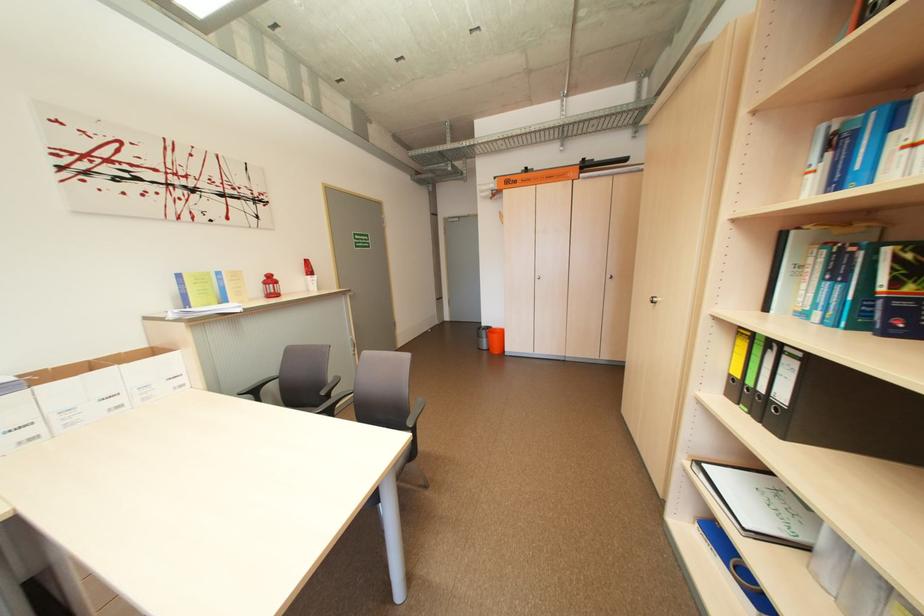
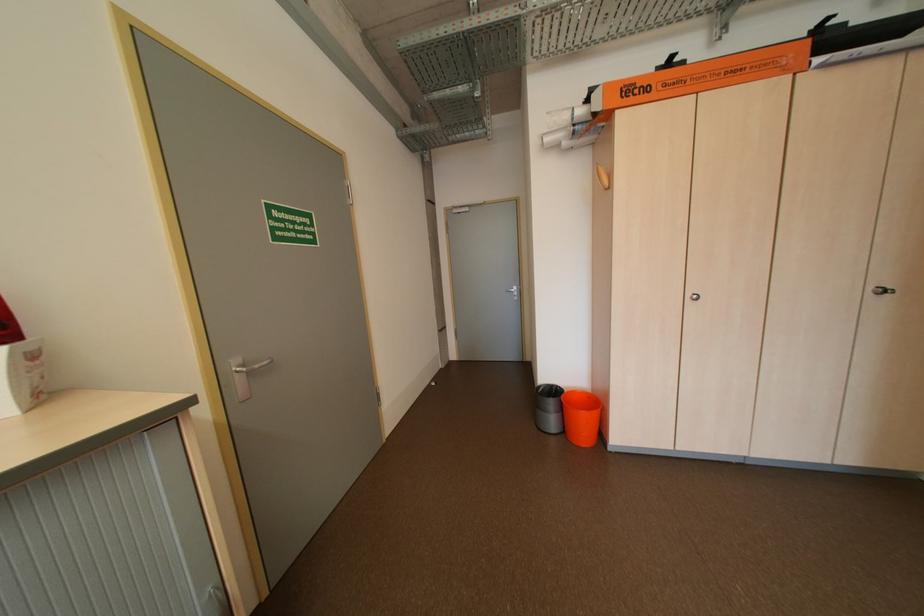
Where in the second image is the point corresponding to (x=525, y=183) from the first image?

(655, 90)